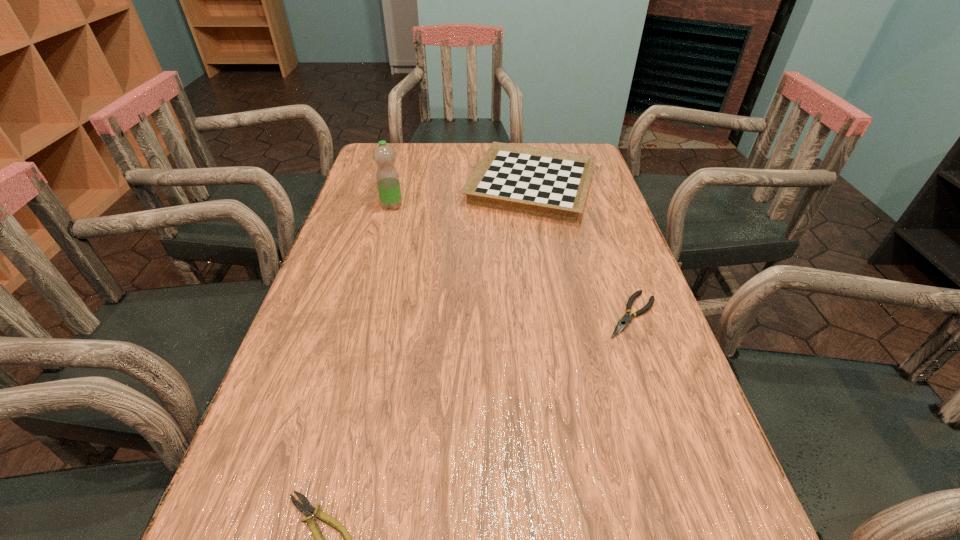
At what (x,y) coordinates should I click in order to perform the action: click on pliers present at the right edge. Please return your answer as a coordinate pair (x, y). The width and height of the screenshot is (960, 540). Looking at the image, I should click on (623, 322).

Image resolution: width=960 pixels, height=540 pixels. I want to click on object present at the far right corner, so click(x=553, y=184).

Locate an element on the screen. The width and height of the screenshot is (960, 540). vacant space at the far edge is located at coordinates (420, 169).

This screenshot has width=960, height=540. In the image, there is a desktop. In order to click on blank space at the left edge in this screenshot , I will do `click(357, 358)`.

The width and height of the screenshot is (960, 540). In order to click on vacant space at the right edge of the desktop in this screenshot , I will do `click(588, 213)`.

Identify the location of vacant space that is in between the checkerboard and the second shortest object. The width and height of the screenshot is (960, 540). (582, 251).

Identify the location of vacant area that lies between the third farthest object and the third shortest object. This screenshot has width=960, height=540. (582, 251).

In order to click on blank region between the third farthest object and the water bottle in this screenshot , I will do `click(512, 260)`.

I want to click on unoccupied position between the taller pliers and the checkerboard, so click(582, 251).

Locate an element on the screen. Image resolution: width=960 pixels, height=540 pixels. free space between the water bottle and the farther pliers is located at coordinates (512, 260).